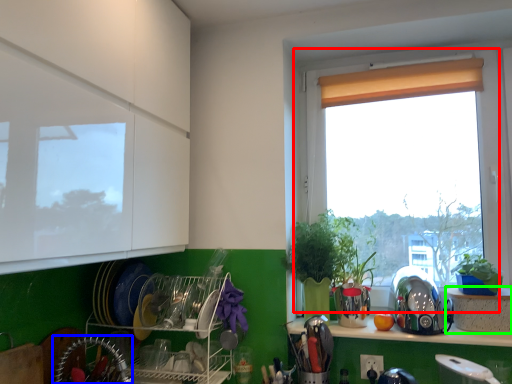
Question: Which is nearer to the window (highlighted by a red box)? appliance (highlighted by a blue box) or cabinetry (highlighted by a green box).

Choices:
 (A) appliance
 (B) cabinetry

Answer: (B)